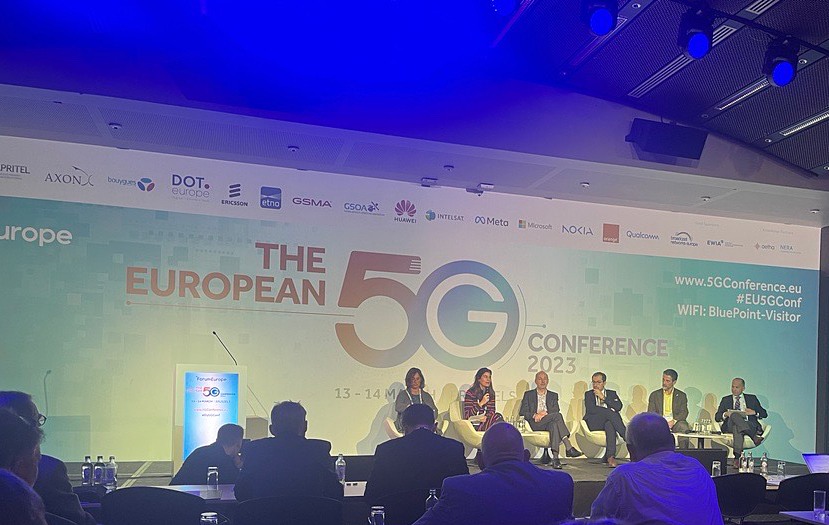
The height and width of the screenshot is (525, 829). In order to click on screen in this screenshot , I will do `click(296, 353)`.